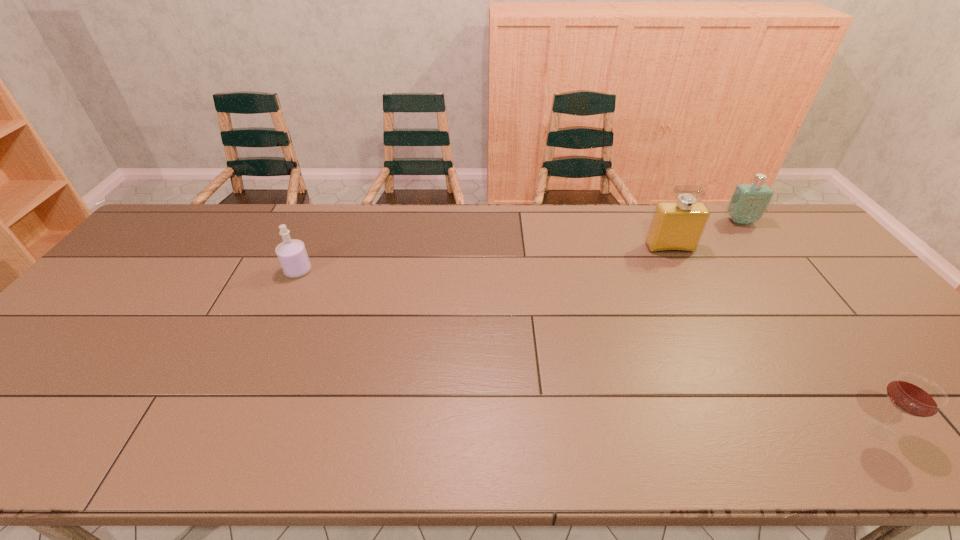
Locate an element on the screen. Image resolution: width=960 pixels, height=540 pixels. the second nearest perfume is located at coordinates (677, 226).

Find the location of a particular element. the second farthest object is located at coordinates (677, 226).

Find the location of `the farthest perfume`. the farthest perfume is located at coordinates (749, 201).

Image resolution: width=960 pixels, height=540 pixels. Identify the location of the rightmost perfume. (749, 201).

Locate an element on the screen. the nearest perfume is located at coordinates (292, 255).

Locate an element on the screen. the leftmost perfume is located at coordinates (292, 255).

Where is `wineglass`? wineglass is located at coordinates [x=915, y=395].

This screenshot has width=960, height=540. In order to click on vacant space located 0.310m on the front-facing side of the second object from left to right in this screenshot , I will do `click(711, 329)`.

Where is `vacant region located on the front label of the farthest perfume`? vacant region located on the front label of the farthest perfume is located at coordinates (806, 308).

What are the coordinates of `vacant region located 0.290m on the back of the second nearest object` in the screenshot? It's located at (326, 210).